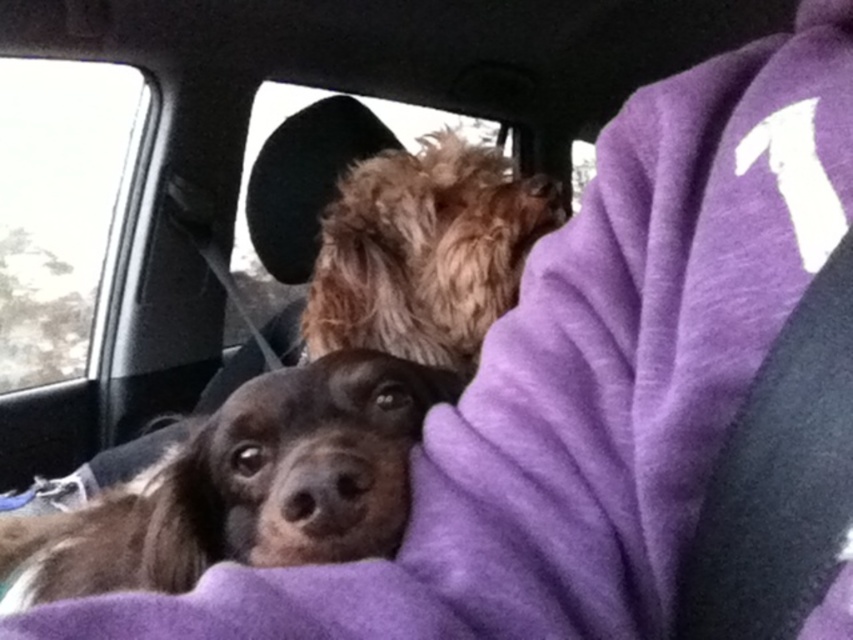
Between point (473, 298) and point (42, 99), which one is positioned behind?

The point (42, 99) is more distant.

Which is behind, point (473, 182) or point (21, 337)?

Positioned behind is point (21, 337).

Where is `fuzzy brown dog at upper center`? fuzzy brown dog at upper center is located at coordinates (424, 252).

Is brown fur dog at center wider than fuzzy brown dog at upper center?

Yes, brown fur dog at center is wider than fuzzy brown dog at upper center.

Is point (357, 548) behind point (322, 300)?

No, it is in front of (322, 300).

Identify the location of brown fur dog at center. This screenshot has height=640, width=853. (245, 486).

Does brown fur dog at center have a greater height compared to transparent glass at upper left?

In fact, brown fur dog at center may be shorter than transparent glass at upper left.

Is brown fur dog at center above transparent glass at upper left?

No.

Does point (157, 536) lie in front of point (24, 380)?

Yes, it is in front of point (24, 380).

Locate an element on the screen. This screenshot has width=853, height=640. brown fur dog at center is located at coordinates (245, 486).